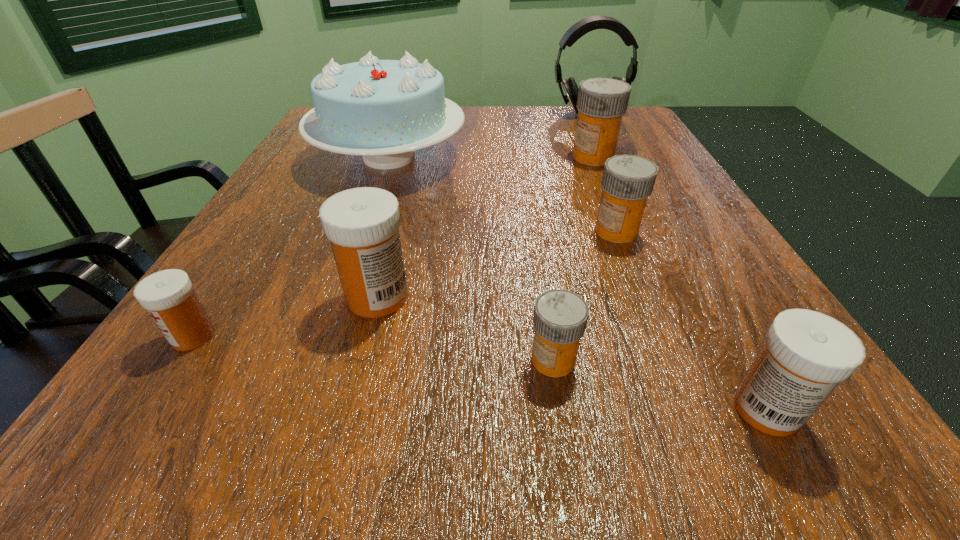
Identify the location of free space that satisfies the following two spatial constraints: 1. on the ear cups of the farthest object; 2. on the label side of the farthest medicine. (610, 157).

You are a GUI agent. You are given a task and a screenshot of the screen. Output one action in this format:
    pyautogui.click(x=<x>, y=<y>)
    Task: Click on the free location that satisfies the following two spatial constraints: 1. on the back side of the nearest white medicine; 2. on the label side of the smallest orange medicine
    The height and width of the screenshot is (540, 960).
    Given the screenshot: What is the action you would take?
    pyautogui.click(x=739, y=360)

This screenshot has width=960, height=540. What are the coordinates of `vacant space that satisfies the following two spatial constraints: 1. on the ear cups of the farthest object; 2. on the label side of the farthest orange medicine` in the screenshot? It's located at (610, 157).